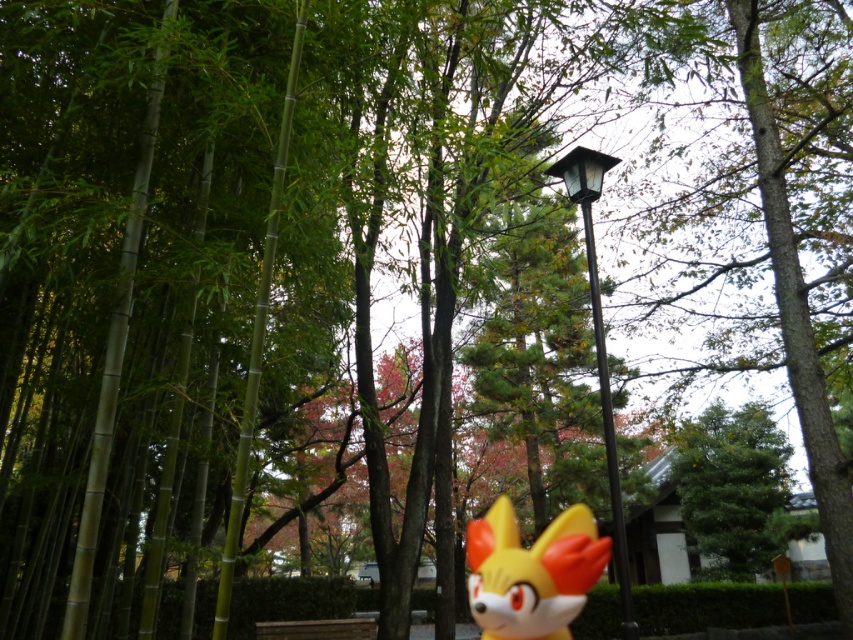
Can you confirm if green textured tree at center is positioned to the left of yellow matte fox head at center?

Incorrect, green textured tree at center is not on the left side of yellow matte fox head at center.

Between green textured tree at center and yellow matte fox head at center, which one has more height?

yellow matte fox head at center is taller.

This screenshot has width=853, height=640. Identify the location of green textured tree at center. (733, 490).

Find the location of a particular element. Image resolution: width=853 pixels, height=640 pixels. green textured tree at center is located at coordinates (733, 490).

From the picture: Which of these two, green textured tree at center or black metal lamp post at center, stands taller?

black metal lamp post at center

Which is behind, point (722, 552) or point (624, 580)?

The point (722, 552) is behind.

The image size is (853, 640). I want to click on green textured tree at center, so (733, 490).

Who is lower down, yellow matte fox head at center or black metal lamp post at center?

yellow matte fox head at center

Who is taller, yellow matte fox head at center or black metal lamp post at center?

With more height is yellow matte fox head at center.

Who is more distant from viewer, (503, 499) or (592, 248)?

The point (503, 499) is behind.

Locate an element on the screen. yellow matte fox head at center is located at coordinates (531, 572).